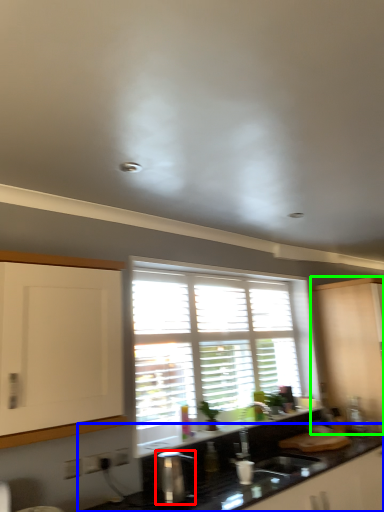
Question: Considering the real-world distances, which object is farthest from appliance (highlighted by a red box)? countertop (highlighted by a blue box) or cabinetry (highlighted by a green box)?

Choices:
 (A) countertop
 (B) cabinetry

Answer: (B)